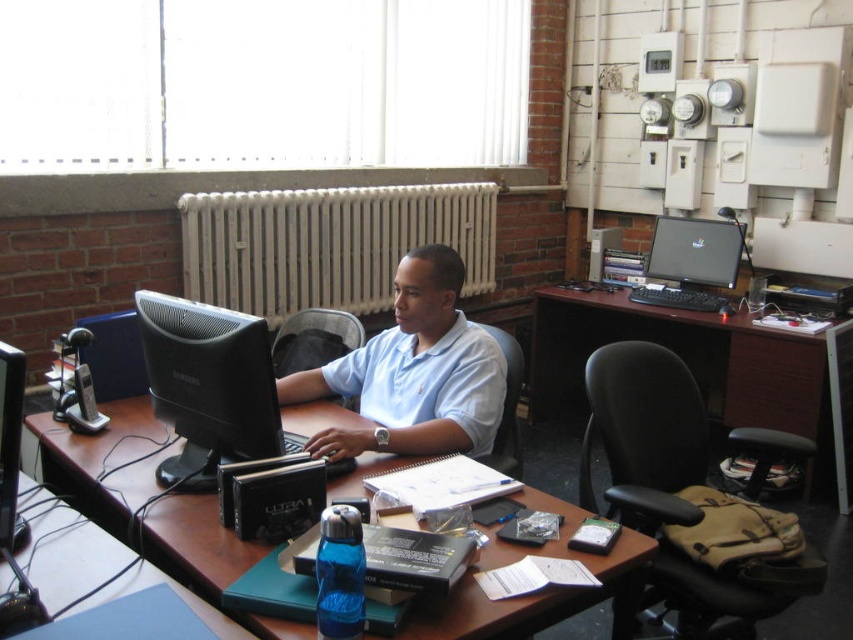
Question: Is brown wooden table at center wider than satin black monitor at center?

Choices:
 (A) yes
 (B) no

Answer: (A)

Question: Which point is farther from the camera taking this photo?

Choices:
 (A) (709, 291)
 (B) (28, 532)
 (C) (334, 433)
 (D) (697, 314)

Answer: (A)

Question: Does brown wooden table at center have a larger size compared to white metal radiator at center?

Choices:
 (A) yes
 (B) no

Answer: (B)

Question: Which point is closer to the camera?

Choices:
 (A) matte black monitor at upper right
 (B) dark wood/black plastic computer desk at upper right
 (C) black glossy monitor at left

Answer: (C)

Question: Which of the following is the farthest from the observer?

Choices:
 (A) black glossy monitor at left
 (B) light blue cotton shirt at center

Answer: (B)

Question: Is brown wooden table at center above dark wood/black plastic computer desk at upper right?

Choices:
 (A) no
 (B) yes

Answer: (A)